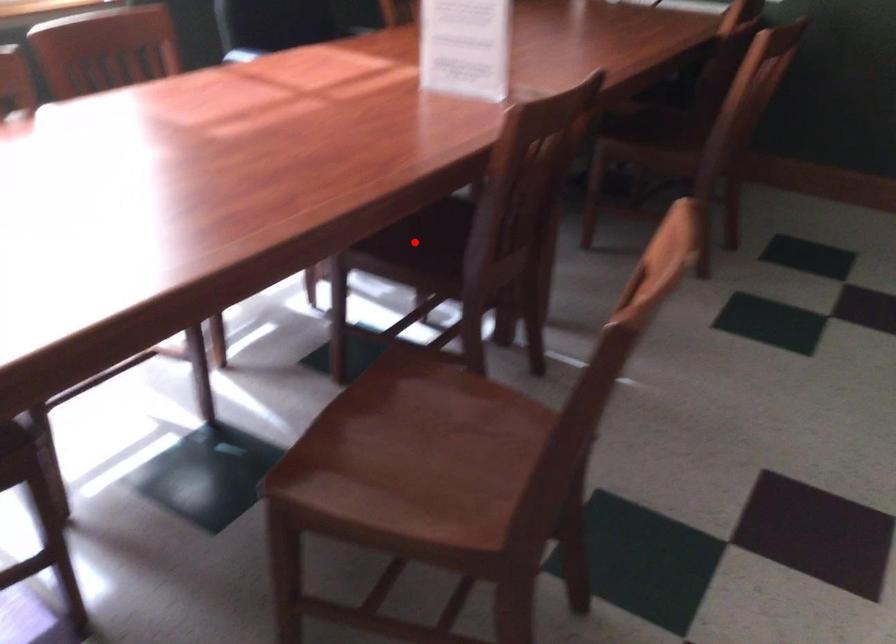
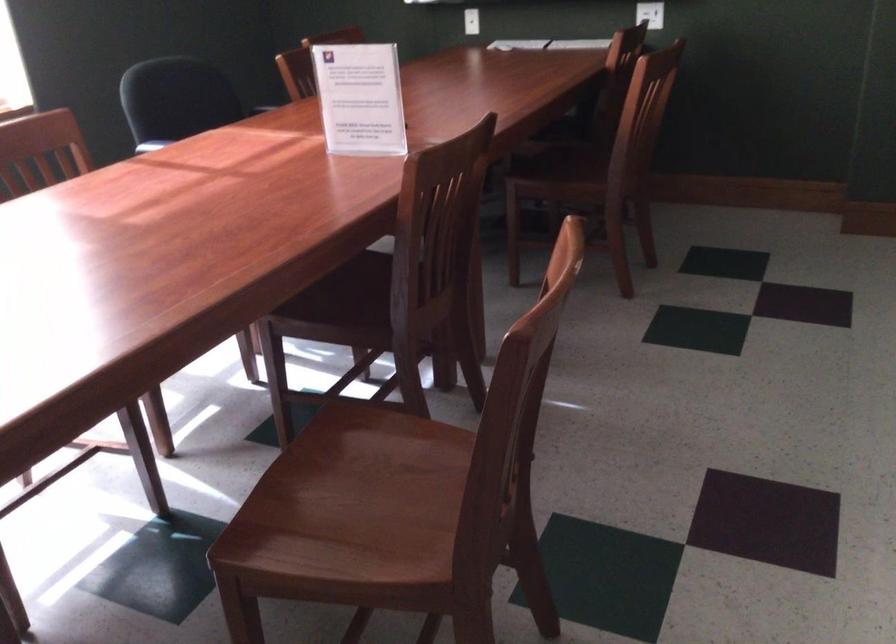
Question: I am providing you with two images of the same scene from different viewpoints. A red point is marked on the first image. At the location where the point appears in image 1, is it still visible in image 2?

Choices:
 (A) Yes
 (B) No

Answer: (A)